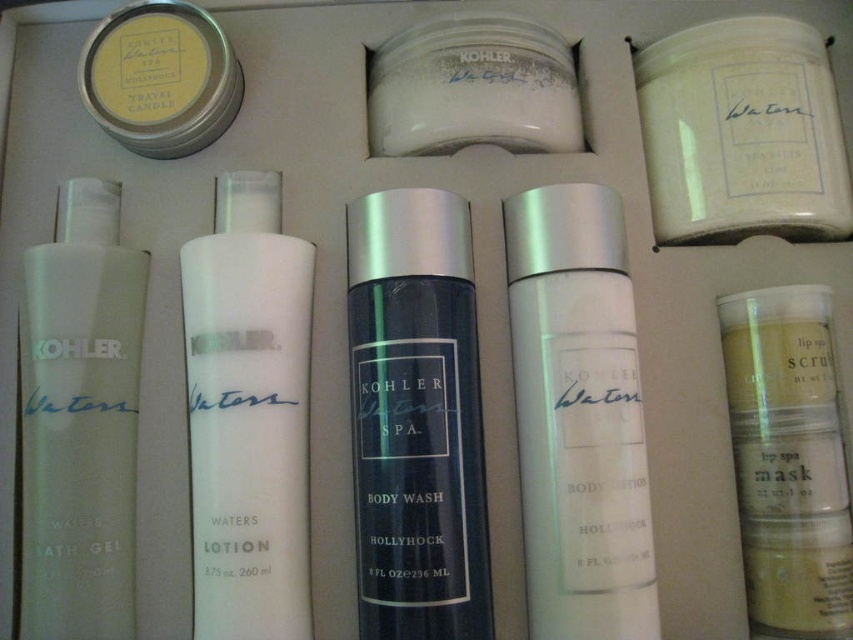
Question: Which of the following is the closest to the observer?

Choices:
 (A) white matte jar at center
 (B) white matte candle at upper right
 (C) matte yellow candle at upper left
 (D) matte black body wash at center

Answer: (D)

Question: Does white matte lotion at center come in front of matte yellow candle at upper left?

Choices:
 (A) no
 (B) yes

Answer: (B)

Question: Estimate the real-world distances between objects in this image. Which object is closer to the white matte lotion at center?

Choices:
 (A) matte yellow lip scrub mask at lower right
 (B) white matte candle at upper right
 (C) matte yellow candle at upper left

Answer: (C)

Question: Does white matte jar at center appear over matte yellow candle at upper left?

Choices:
 (A) no
 (B) yes

Answer: (A)

Question: Which object is positioned closest to the white matte jar at center?

Choices:
 (A) white matte candle at upper right
 (B) white matte lotion at center
 (C) white matte body lotion at center

Answer: (A)

Question: Does translucent plastic bath gel at left appear on the right side of white matte candle at upper right?

Choices:
 (A) yes
 (B) no

Answer: (B)